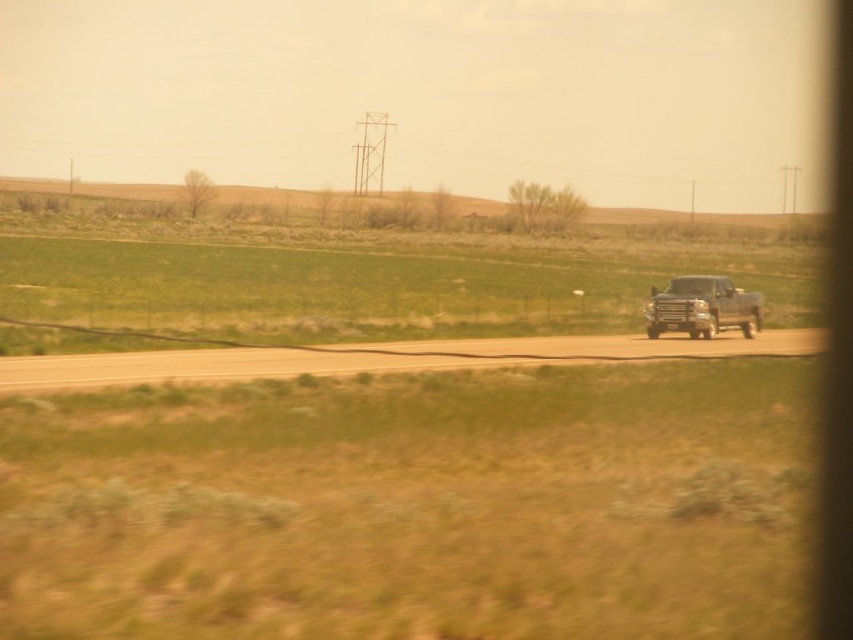
You are a driver approaching the smooth asphalt highway at center and see the metallic silver truck at right. Which object will appear bigger in your view as you get closer?

The smooth asphalt highway at center will appear bigger in your view as you get closer because it is larger in size than the metallic silver truck at right.

You are a driver approaching the smooth asphalt highway at center and the metallic silver truck at right. Which object is closer to your current position?

The metallic silver truck at right is closer to your current position because it is to the right of the smooth asphalt highway at center, which is further away.

You are a drone operator planning to fly a drone over the smooth asphalt highway at center and the metallic silver truck at right. Considering their heights, which object will the drone have to ascend higher to fly over?

The smooth asphalt highway at center is taller than the metallic silver truck at right, so the drone will need to ascend higher to fly over the smooth asphalt highway at center.